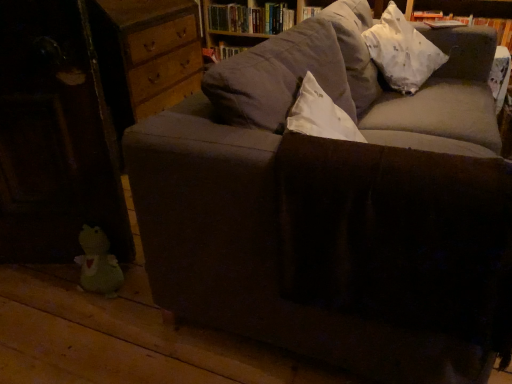
Question: Does white paper book at upper right, marked as the 2th book in a back-to-front arrangement, appear on the right side of green plush toy at lower left?

Choices:
 (A) yes
 (B) no

Answer: (A)

Question: Would you say white paper book at upper right, which is the first book from right to left, is outside green plush toy at lower left?

Choices:
 (A) yes
 (B) no

Answer: (A)

Question: Is there a large distance between white paper book at upper right, marked as the 2th book in a back-to-front arrangement, and green plush toy at lower left?

Choices:
 (A) no
 (B) yes

Answer: (B)

Question: Is white paper book at upper right, marked as the 2th book in a back-to-front arrangement, wider than green plush toy at lower left?

Choices:
 (A) yes
 (B) no

Answer: (A)

Question: From the image's perspective, is white paper book at upper right, which is the first book from right to left, on green plush toy at lower left?

Choices:
 (A) yes
 (B) no

Answer: (A)

Question: Can you confirm if white paper book at upper right, the 2th book positioned from the left, is bigger than green plush toy at lower left?

Choices:
 (A) yes
 (B) no

Answer: (A)

Question: Is hardcover books at upper center, arranged as the second book when viewed from the right, not near green plush toy at lower left?

Choices:
 (A) yes
 (B) no

Answer: (A)

Question: Is hardcover books at upper center, the 1th book in the back-to-front sequence, not within green plush toy at lower left?

Choices:
 (A) no
 (B) yes

Answer: (B)

Question: Is hardcover books at upper center, placed as the first book when sorted from left to right, thinner than green plush toy at lower left?

Choices:
 (A) yes
 (B) no

Answer: (B)

Question: Is hardcover books at upper center, the 1th book in the back-to-front sequence, closer to the viewer compared to green plush toy at lower left?

Choices:
 (A) yes
 (B) no

Answer: (B)

Question: From the image's perspective, is hardcover books at upper center, the 1th book in the back-to-front sequence, on top of green plush toy at lower left?

Choices:
 (A) yes
 (B) no

Answer: (A)

Question: Is hardcover books at upper center, the 1th book in the back-to-front sequence, at the left side of green plush toy at lower left?

Choices:
 (A) yes
 (B) no

Answer: (B)

Question: Considering the relative sizes of white fabric pillow at upper right and green plush toy at lower left in the image provided, is white fabric pillow at upper right bigger than green plush toy at lower left?

Choices:
 (A) no
 (B) yes

Answer: (B)